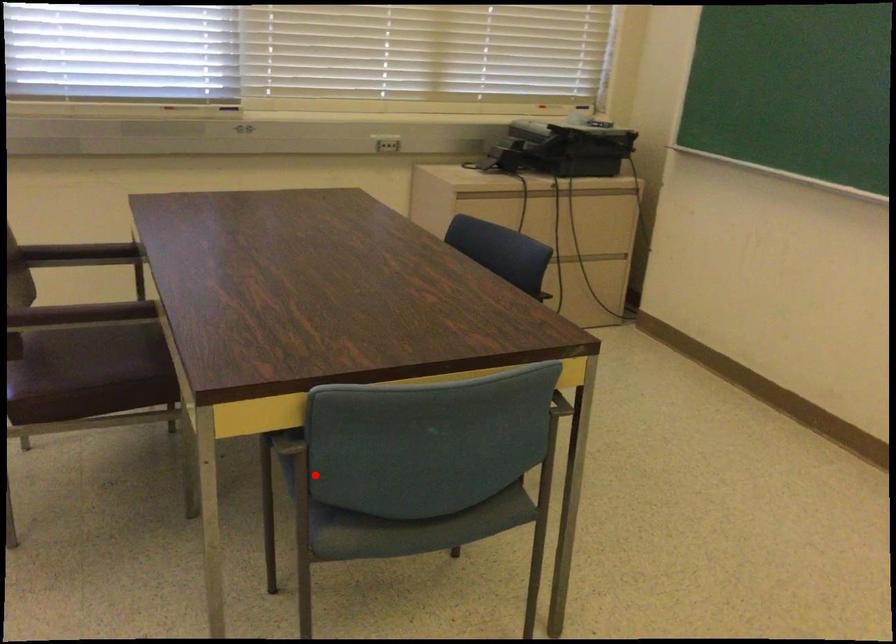
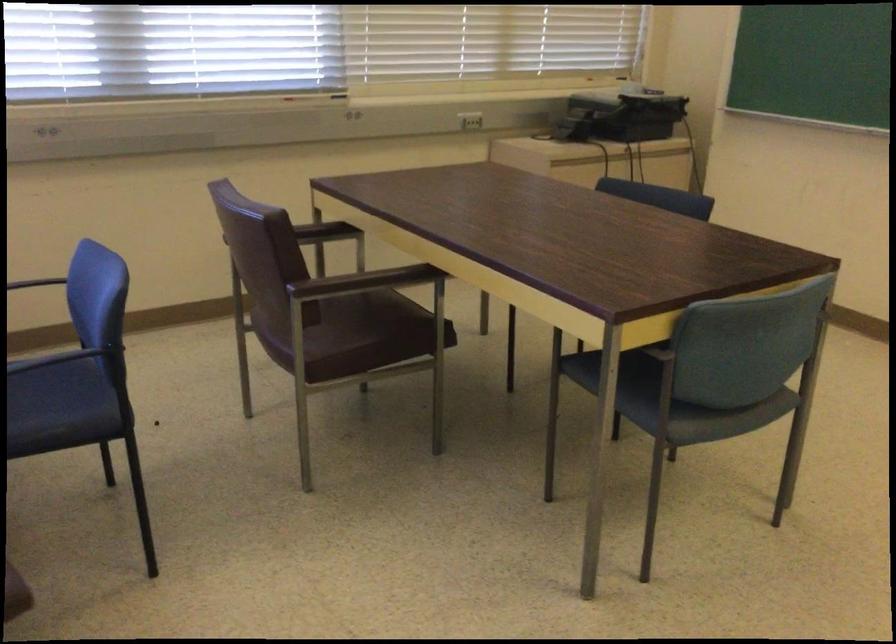
Question: I am providing you with two images of the same scene from different viewpoints. A red point is marked on the first image. Is the red point's position out of view in image 2?

Choices:
 (A) Yes
 (B) No

Answer: (B)